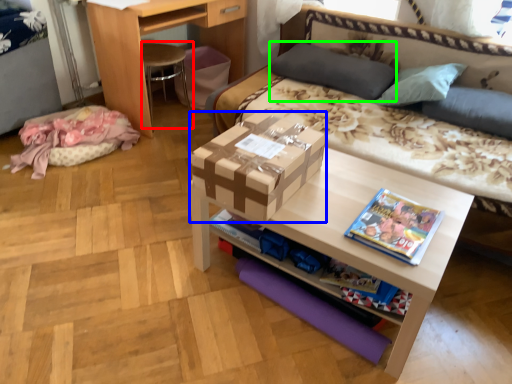
Question: Which object is positioned farthest from chair (highlighted by a red box)? Select from box (highlighted by a blue box) and pillow (highlighted by a green box).

Choices:
 (A) box
 (B) pillow

Answer: (A)